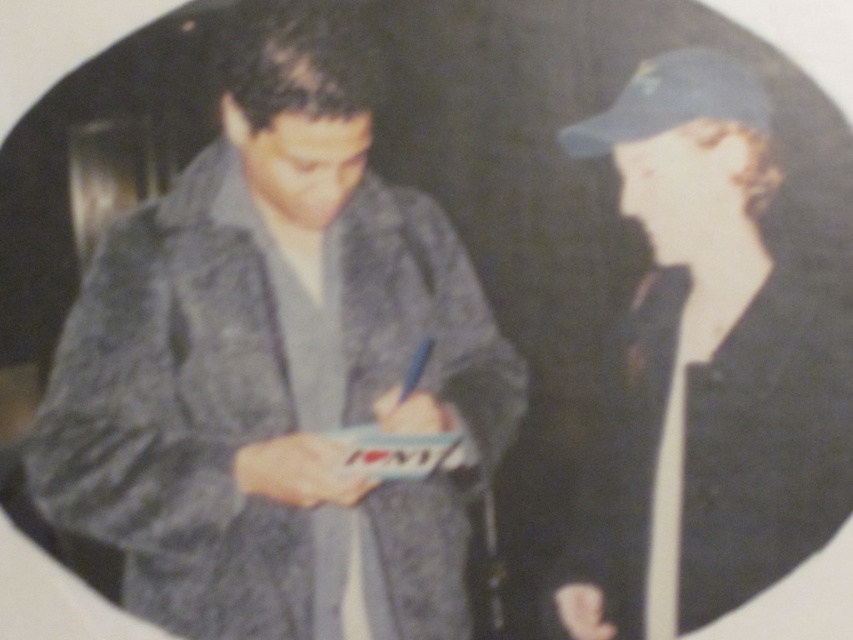
Question: Which point is closer to the camera?

Choices:
 (A) (592, 547)
 (B) (674, 97)

Answer: (B)

Question: Among these objects, which one is nearest to the camera?

Choices:
 (A) velvet-like gray coat at center
 (B) dark blue felt baseball hat at upper right

Answer: (A)

Question: Among these objects, which one is farthest from the camera?

Choices:
 (A) matte blue cap at upper right
 (B) dark blue felt baseball hat at upper right

Answer: (B)

Question: Does velvet-like gray coat at center appear under dark blue felt baseball hat at upper right?

Choices:
 (A) yes
 (B) no

Answer: (A)

Question: In this image, where is velvet-like gray coat at center located relative to matte blue cap at upper right?

Choices:
 (A) right
 (B) left

Answer: (B)

Question: Is velvet-like gray coat at center below dark blue felt baseball hat at upper right?

Choices:
 (A) no
 (B) yes

Answer: (B)